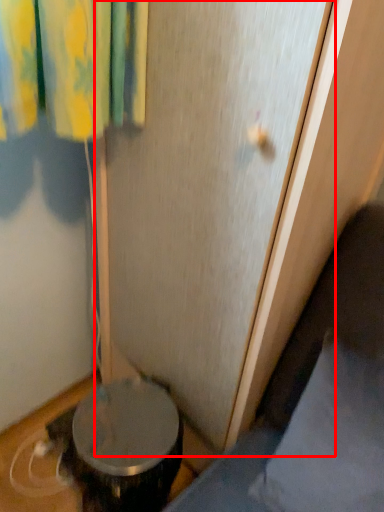
Question: Considering the relative positions of screen door (annotated by the red box) and pillow in the image provided, where is screen door (annotated by the red box) located with respect to the staircase?

Choices:
 (A) right
 (B) left

Answer: (B)